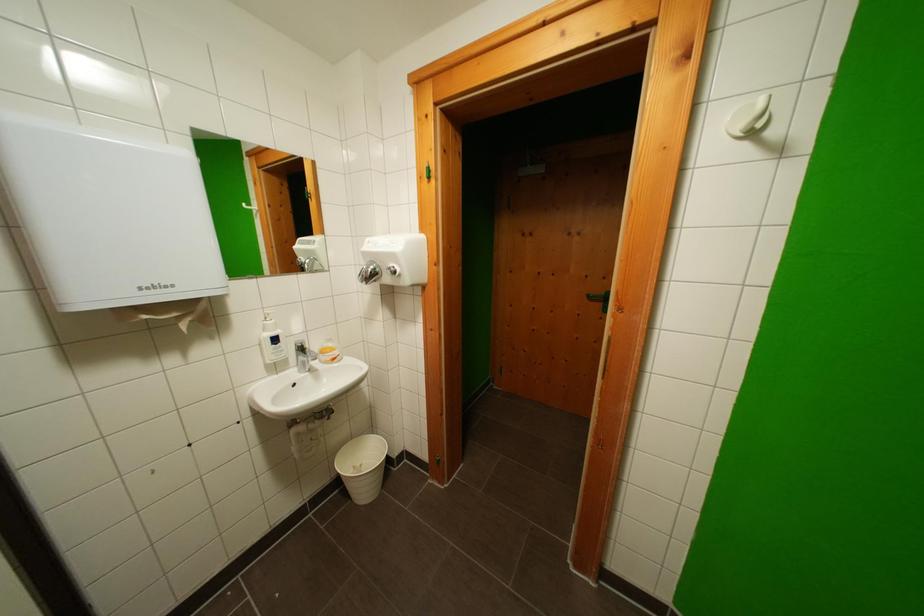
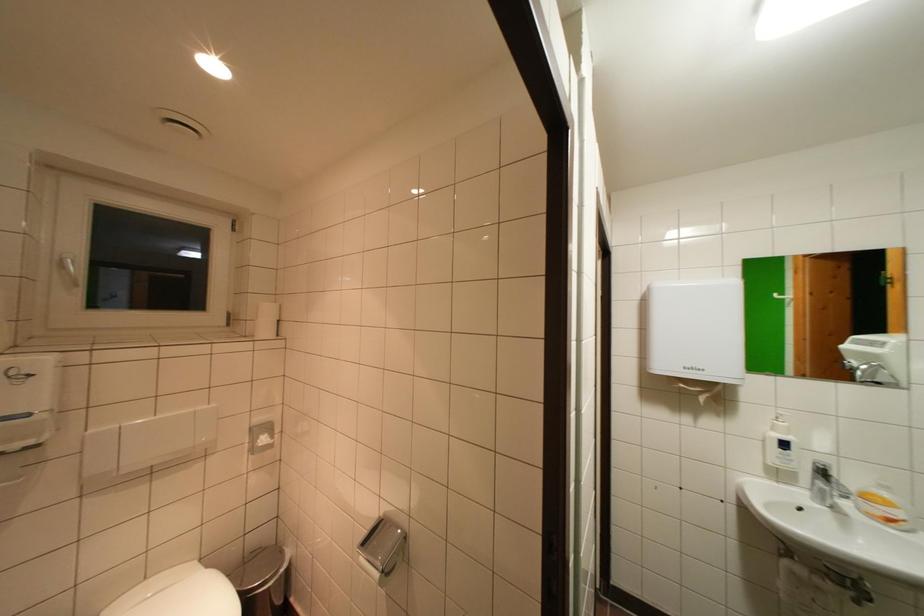
In the second image, find the point that corresponds to point 310,350 in the first image.

(833, 474)